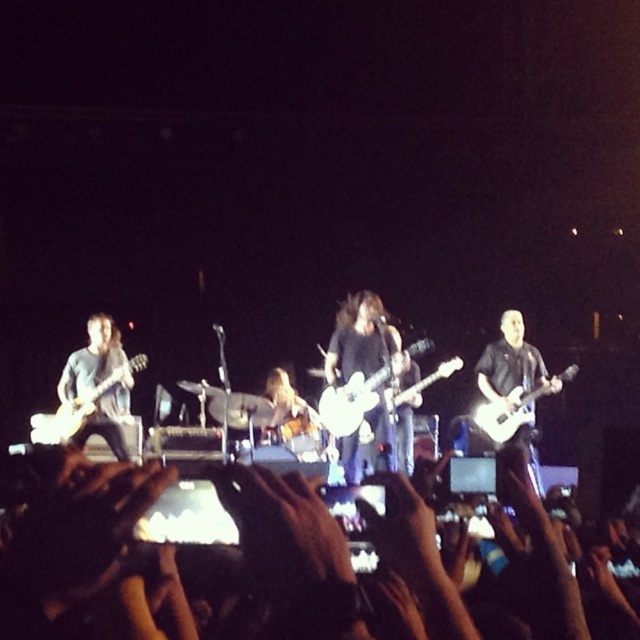
Question: Does matte black guitar at left lie in front of white glossy electric guitar at right?

Choices:
 (A) no
 (B) yes

Answer: (B)

Question: Among these objects, which one is nearest to the camera?

Choices:
 (A) white matte electric guitar at left
 (B) matte black guitar at center
 (C) matte black guitar at right
 (D) matte black guitar at left

Answer: (C)

Question: Does dark skin hands at lower center have a lesser width compared to matte black guitar at left?

Choices:
 (A) no
 (B) yes

Answer: (A)

Question: Is the position of matte black guitar at right more distant than that of matte black guitar at center?

Choices:
 (A) yes
 (B) no

Answer: (B)

Question: Considering the real-world distances, which object is closest to the matte black guitar at center?

Choices:
 (A) white glossy electric guitar at right
 (B) matte black guitar at left
 (C) matte black guitar at right
 (D) dark skin hands at lower center

Answer: (B)

Question: Which object appears closest to the camera in this image?

Choices:
 (A) dark skin hands at lower center
 (B) white matte electric guitar at left
 (C) white glossy electric guitar at right
 (D) shiny black guitar at center

Answer: (A)